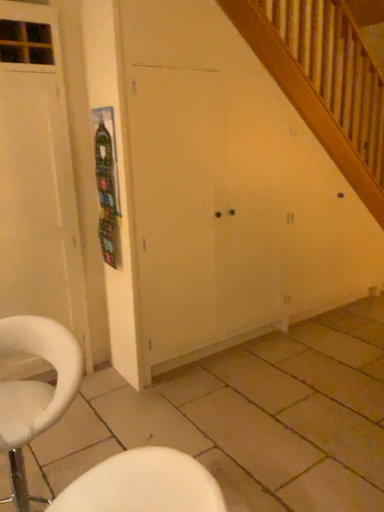
Question: Looking at their shapes, would you say metallic silver poster at upper left is wider or thinner than beige tile at lower center?

Choices:
 (A) wide
 (B) thin

Answer: (B)

Question: From the image's perspective, relative to beige tile at lower center, is metallic silver poster at upper left above or below?

Choices:
 (A) below
 (B) above

Answer: (B)

Question: Which is nearer to the metallic silver poster at upper left?

Choices:
 (A) beige tile at lower center
 (B) white fabric chair at lower left
 (C) white wood door at left
 (D) white matte cabinet at center

Answer: (C)

Question: Which of these objects is positioned closest to the white wood door at left?

Choices:
 (A) beige tile at lower center
 (B) white matte cabinet at center
 (C) metallic silver poster at upper left
 (D) white fabric chair at lower left

Answer: (C)